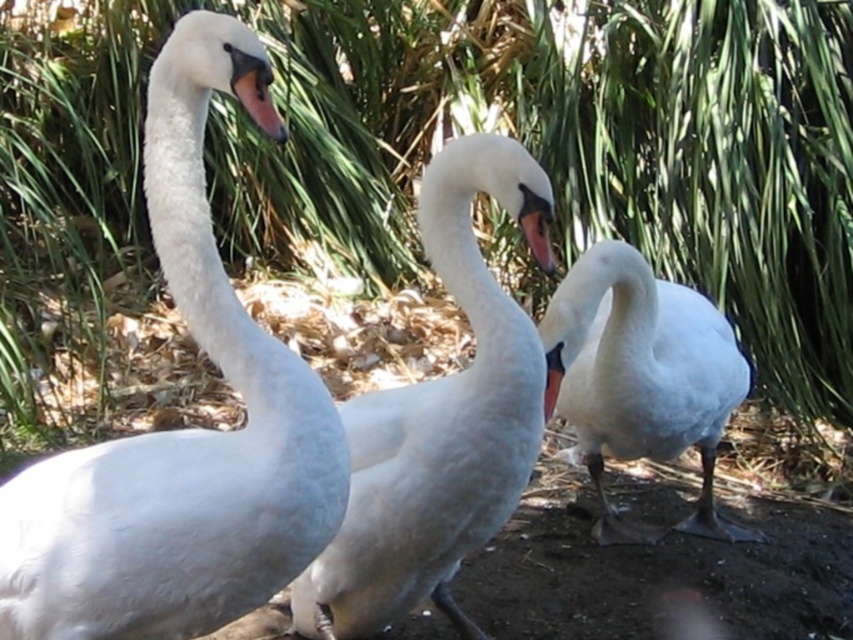
You are a wildlife photographer aiming to capture a closeup of the matte orange beak at center. You are currently positioned near the white matte swan at left. Considering their sizes, which object should you focus on first to ensure you get the best shot?

The white matte swan at left is larger in size than the matte orange beak at center. Therefore, you should focus on the white matte swan at left first to ensure proper framing and focus before adjusting for the smaller matte orange beak at center.